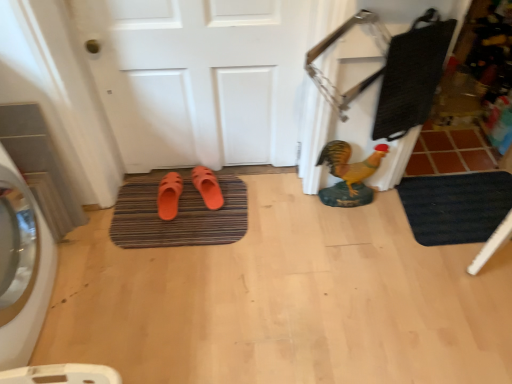
At what (x,y) coordinates should I click in order to perform the action: click on blank space to the left of yellow matte chicken at center-right. Please return your answer as a coordinate pair (x, y). This screenshot has width=512, height=384. Looking at the image, I should click on (297, 205).